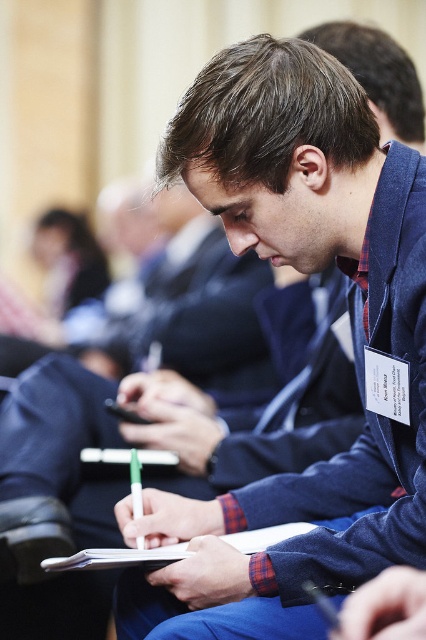
The scene shows a young man in a dark blue blazer and a red and blue checkered shirt, along with other attendees in the background. Where is the blue fabric jacket at center located in relation to the point marked at coordinates (351,336)?

The point at coordinates (351,336) marks the blue fabric jacket at center, indicating it is precisely at that location.

You are an event organizer who needs to place a name tag holder on the table between the blue fabric jacket at center and the white paper clipboard at center. Where should you place it so that it is equidistant from both objects?

The name tag holder should be placed exactly between the blue fabric jacket at center and the white paper clipboard at center, since the blue fabric jacket at center is to the right of the white paper clipboard at center, placing it in the middle would ensure equal distance from both.

You are a photographer standing at the back of the room. You want to take a photo of the blue fabric jacket at center and the white paper clipboard at center so that both are clearly visible in the frame. Given that your camera has a depth of field that can sharply focus on objects within a 30 cm range, will both items be in focus?

The blue fabric jacket at center is 25.93 centimeters away from the white paper clipboard at center. Since the distance between them is less than 30 cm, both items will be within the camera s depth of field and thus both will be in focus.